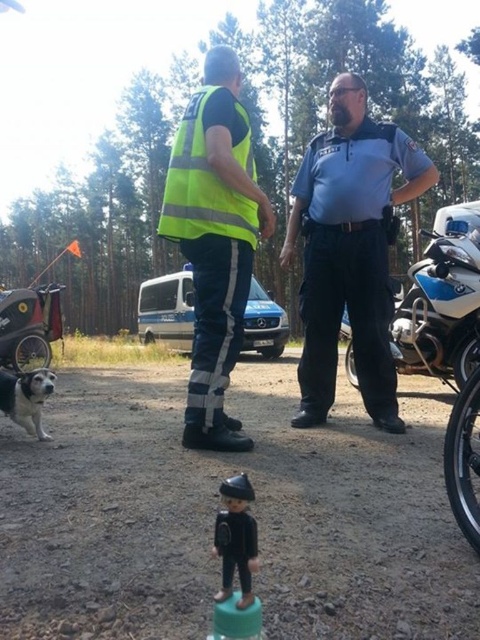
Question: Can you confirm if blue uniform at center is positioned above black matte toy at center?

Choices:
 (A) yes
 (B) no

Answer: (A)

Question: Does yellow reflective vest at center have a greater width compared to blue metallic motorcycle at right?

Choices:
 (A) yes
 (B) no

Answer: (A)

Question: Among these objects, which one is nearest to the camera?

Choices:
 (A) brushed metal stroller at lower left
 (B) blue metallic motorcycle at right

Answer: (B)

Question: Which point appears closest to the camera in this image?

Choices:
 (A) (470, 385)
 (B) (226, 195)
 (C) (28, 358)

Answer: (A)

Question: Does blue uniform at center appear over blue metallic motorcycle at right?

Choices:
 (A) no
 (B) yes

Answer: (B)

Question: Which object is farther from the camera taking this photo?

Choices:
 (A) white fur dog at lower left
 (B) brushed metal stroller at lower left

Answer: (B)